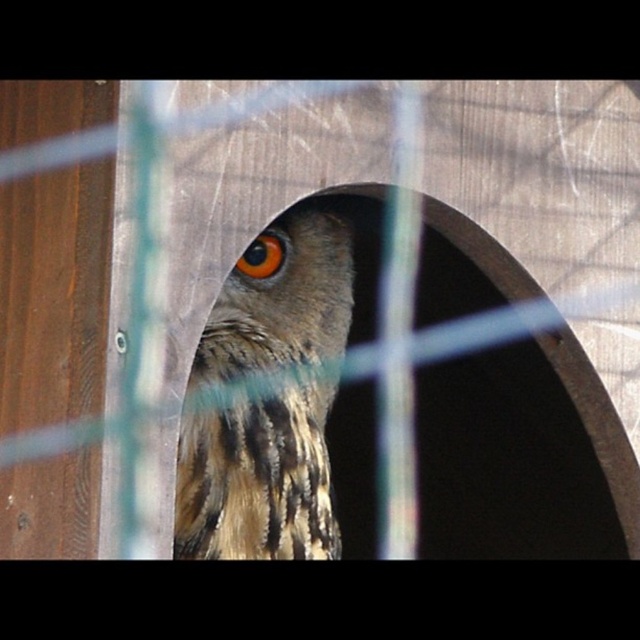
You are a wildlife photographer trying to capture a closeup of the brown speckled feathers at center and the brown textured eye at center of an owl. Based on the scene, which object occupies more horizontal space in the image?

The brown speckled feathers at center occupies more horizontal space in the image because its width is larger than that of the brown textured eye at center.

You are an ornithologist examining the owl in the wooden structure. You notice a specific point marked at coordinates point (257,480). What feature of the owl is located at this point?

The point (257,480) indicates brown speckled feathers at center, which are part of the owl.

You are a photographer trying to capture a closeup of an owl in a wooden enclosure. The owl is positioned at point (324, 250). If you are standing 5.66 feet away from the owl, can you get a clear shot without moving closer?

The point (324, 250) is 5.66 feet away from the camera. Since the photographer is already at that distance, they can capture a clear closeup shot without needing to move closer.